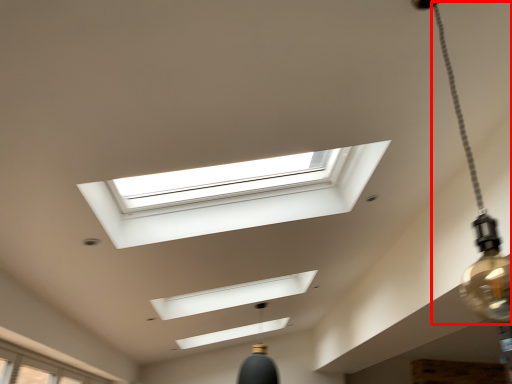
Question: Where is lamp (annotated by the red box) located in relation to window in the image?

Choices:
 (A) right
 (B) left

Answer: (A)